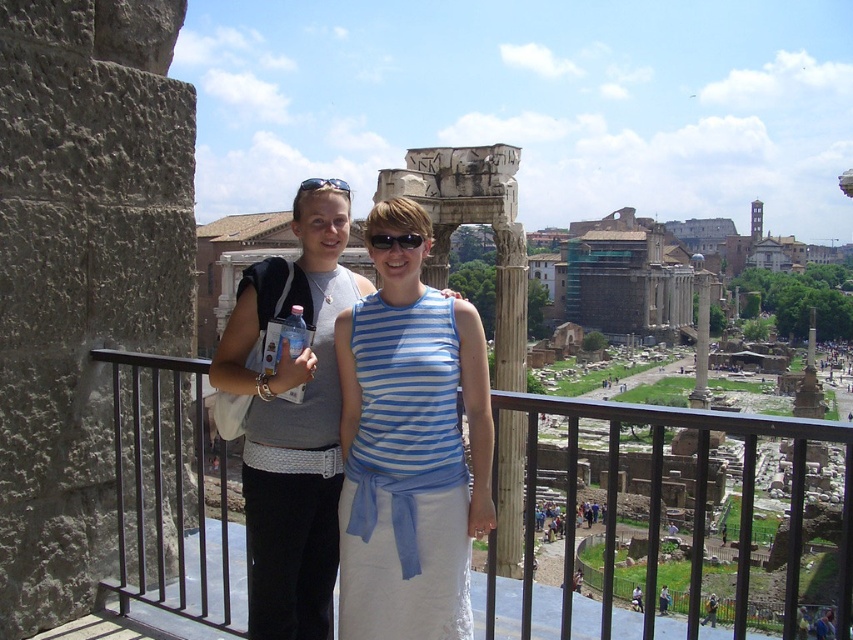
You are a photographer standing on a balcony overlooking an ancient Roman ruin site. You want to take a photo of the wooden column at center and the black plastic sunglasses at center. How far apart are these two objects in the image?

The distance between the wooden column at center and the black plastic sunglasses at center is 14.26 meters.

You are a photographer trying to capture a clear shot of both the black plastic sunglasses at center and the shiny black sunglasses at upper center. Since you want to ensure both are visible, which sunglasses should you focus on first to avoid them overlapping?

You should focus on the shiny black sunglasses at upper center first because it occupies more space than the black plastic sunglasses at center, making it easier to position without overlapping.